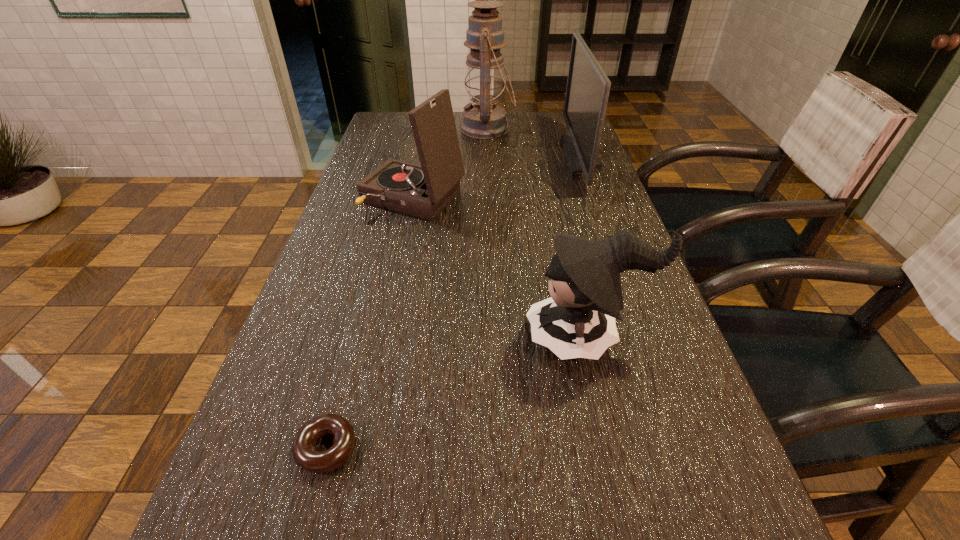
What are the coordinates of `doll that is at the right edge` in the screenshot? It's located at (578, 321).

Locate an element on the screen. object that is at the far right corner is located at coordinates (587, 92).

At what (x,y) coordinates should I click in order to perform the action: click on free region at the far edge. Please return your answer as a coordinate pair (x, y). Looking at the image, I should click on (521, 131).

You are a GUI agent. You are given a task and a screenshot of the screen. Output one action in this format:
    pyautogui.click(x=<x>, y=<y>)
    Task: Click on the vacant position at the left edge of the desktop
    The width and height of the screenshot is (960, 540).
    Given the screenshot: What is the action you would take?
    pyautogui.click(x=321, y=441)

At what (x,y) coordinates should I click in order to perform the action: click on free space at the right edge of the desktop. Please return your answer as a coordinate pair (x, y). Looking at the image, I should click on (611, 219).

Image resolution: width=960 pixels, height=540 pixels. Identify the location of free space that is in between the phonograph record and the shortest object. (370, 322).

I want to click on unoccupied position between the second nearest object and the phonograph record, so click(x=500, y=268).

This screenshot has width=960, height=540. Identify the location of blank region between the nearest object and the tallest object. (407, 288).

In order to click on unoccupied position between the monitor and the phonograph record in this screenshot , I will do `click(497, 177)`.

This screenshot has width=960, height=540. I want to click on empty space between the monitor and the phonograph record, so click(x=497, y=177).